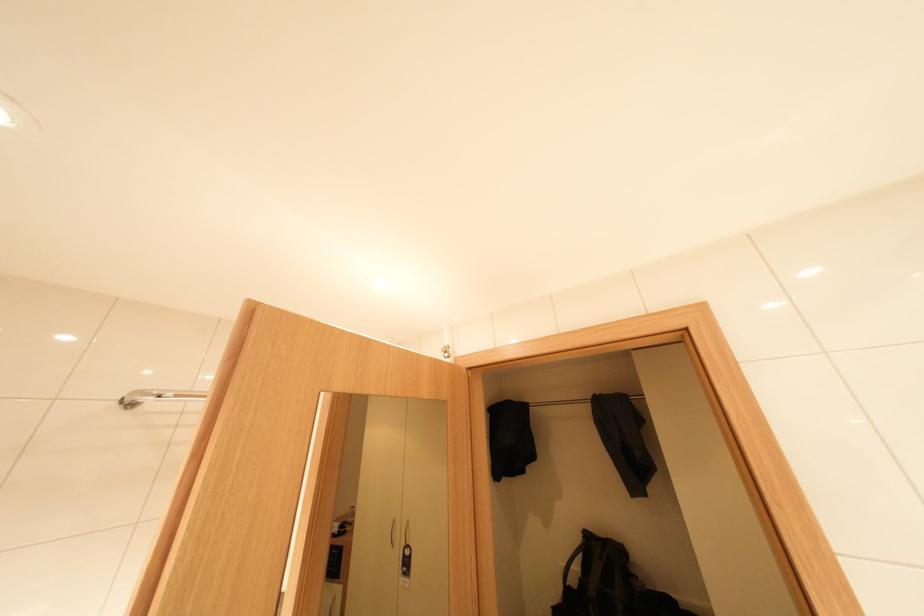
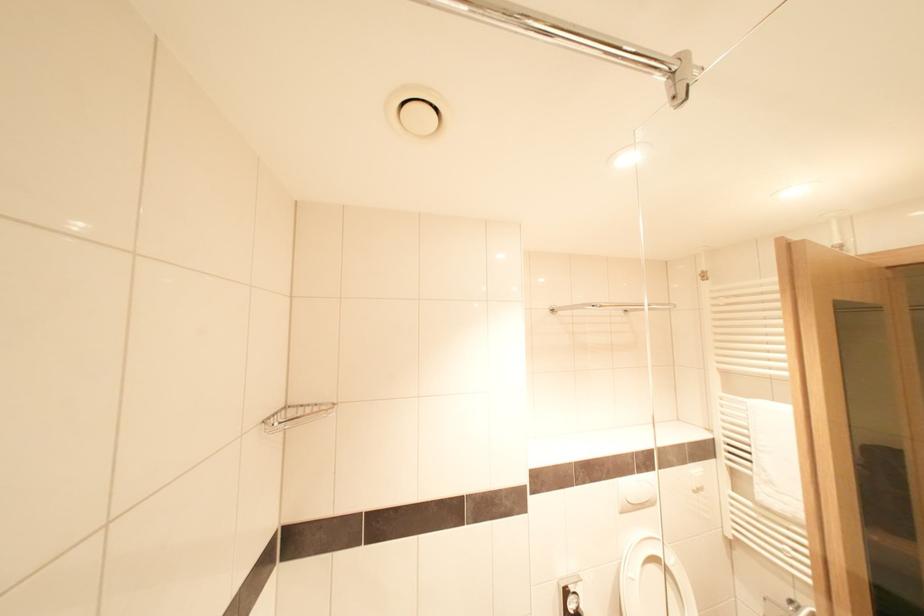
Based on the continuous images, in which direction is the camera rotating?

The camera's rotation is toward left-down.